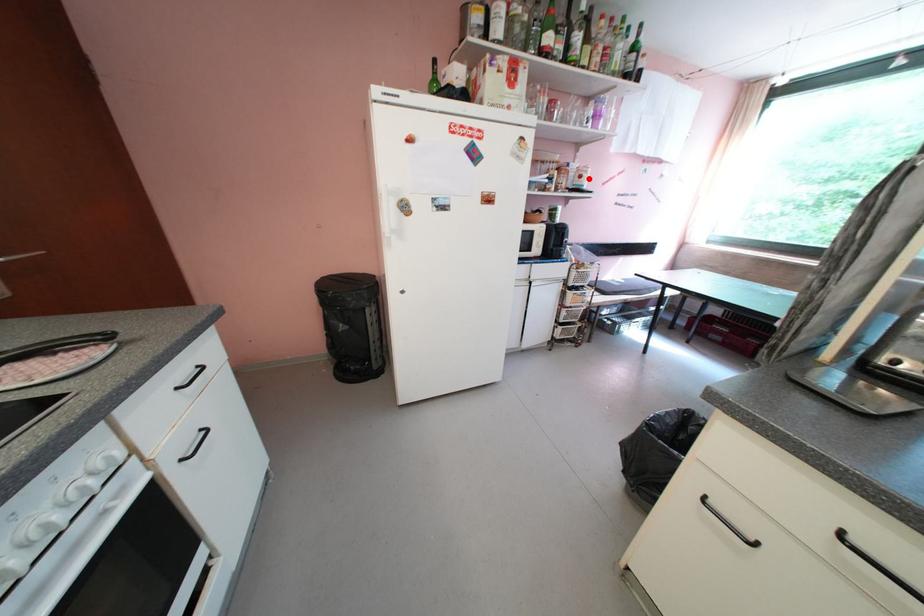
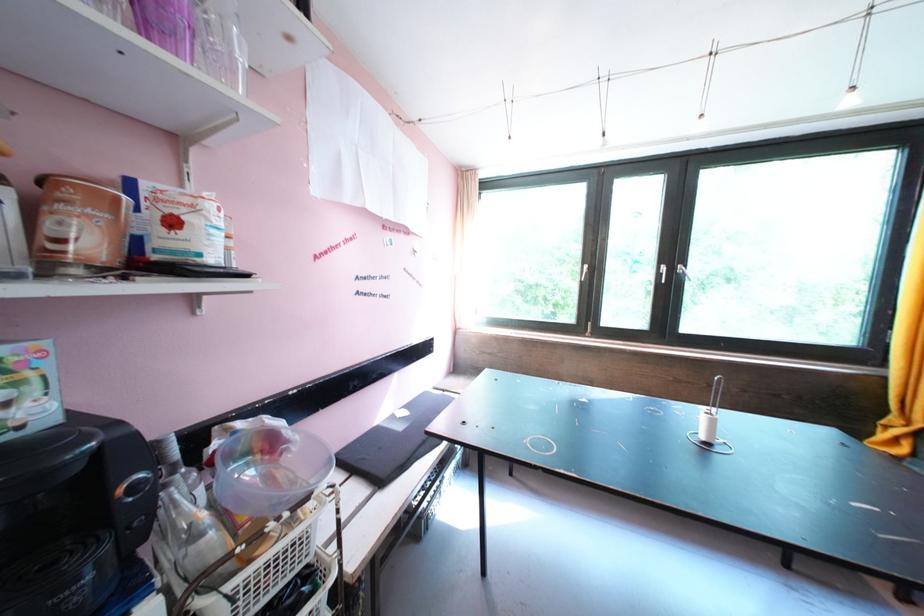
In the second image, find the point that corresponds to the highlighted location in the first image.

(181, 225)